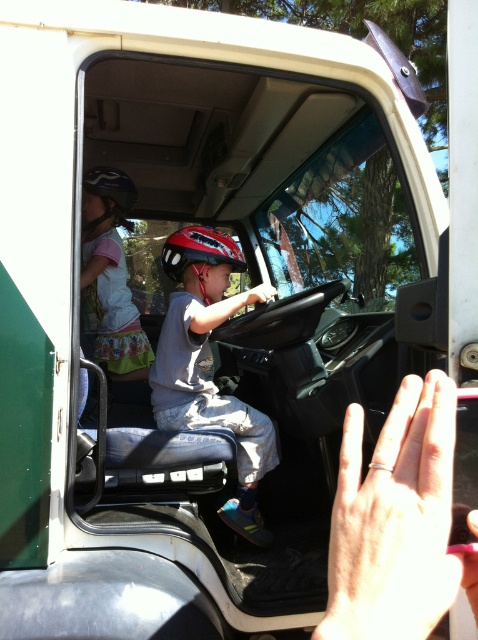
Which of these two, matte gray helmet at center or matte black helmet at upper left, stands taller?

Standing taller between the two is matte gray helmet at center.

Is matte gray helmet at center smaller than matte black helmet at upper left?

Actually, matte gray helmet at center might be larger than matte black helmet at upper left.

Consider the image. Who is more forward, (x=195, y=225) or (x=108, y=172)?

Positioned in front is point (x=108, y=172).

The image size is (478, 640). Identify the location of matte gray helmet at center. (209, 364).

Is matte gray helmet at center taller than matte red helmet at center?

Yes, matte gray helmet at center is taller than matte red helmet at center.

Between matte gray helmet at center and matte red helmet at center, which one is positioned lower?

matte gray helmet at center is below.

Describe the element at coordinates (209, 364) in the screenshot. I see `matte gray helmet at center` at that location.

Identify the location of matte gray helmet at center. (209, 364).

Can you confirm if matte black helmet at upper left is shorter than matte red helmet at center?

Incorrect, matte black helmet at upper left's height does not fall short of matte red helmet at center's.

Which is above, matte black helmet at upper left or matte red helmet at center?

Positioned higher is matte red helmet at center.

You are a GUI agent. You are given a task and a screenshot of the screen. Output one action in this format:
    pyautogui.click(x=<x>, y=<y>)
    Task: Click on the matte black helmet at upper left
    
    Given the screenshot: What is the action you would take?
    pyautogui.click(x=109, y=276)

Locate an element on the screen. This screenshot has width=478, height=640. matte black helmet at upper left is located at coordinates (109, 276).